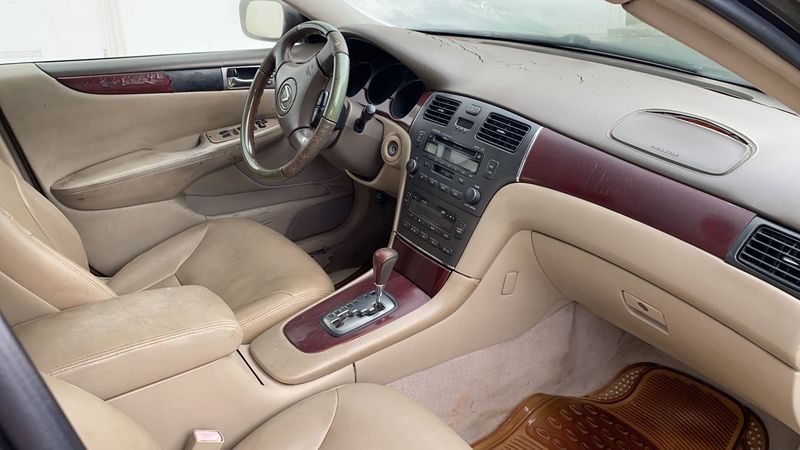
You are a GUI agent. You are given a task and a screenshot of the screen. Output one action in this format:
    pyautogui.click(x=<x>, y=<y>)
    Task: Click on the seats
    The width and height of the screenshot is (800, 450).
    Given the screenshot: What is the action you would take?
    pyautogui.click(x=388, y=423), pyautogui.click(x=253, y=265)